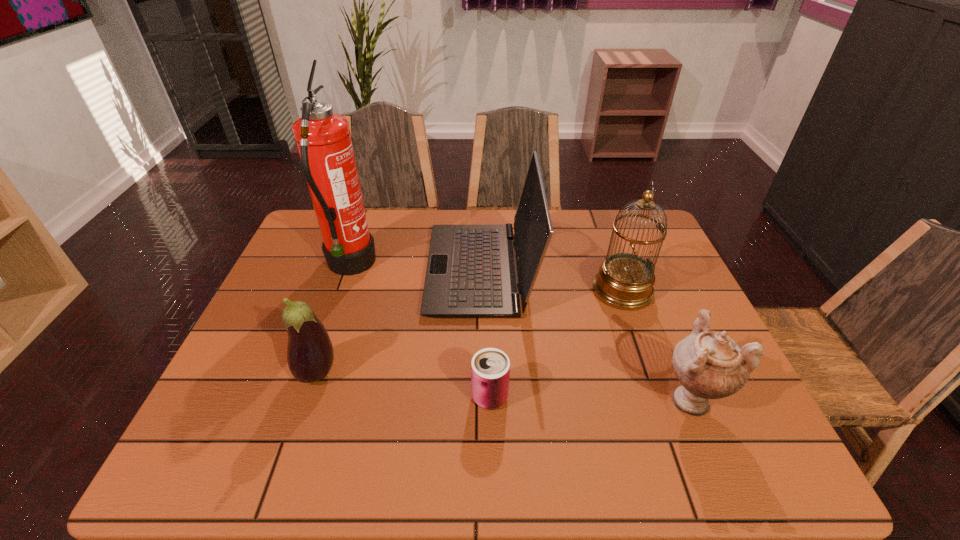
Where is `free space that satisfies the following two spatial constraints: 1. on the front-facing side of the tallest object; 2. on the left side of the eggplant`? free space that satisfies the following two spatial constraints: 1. on the front-facing side of the tallest object; 2. on the left side of the eggplant is located at coordinates (313, 372).